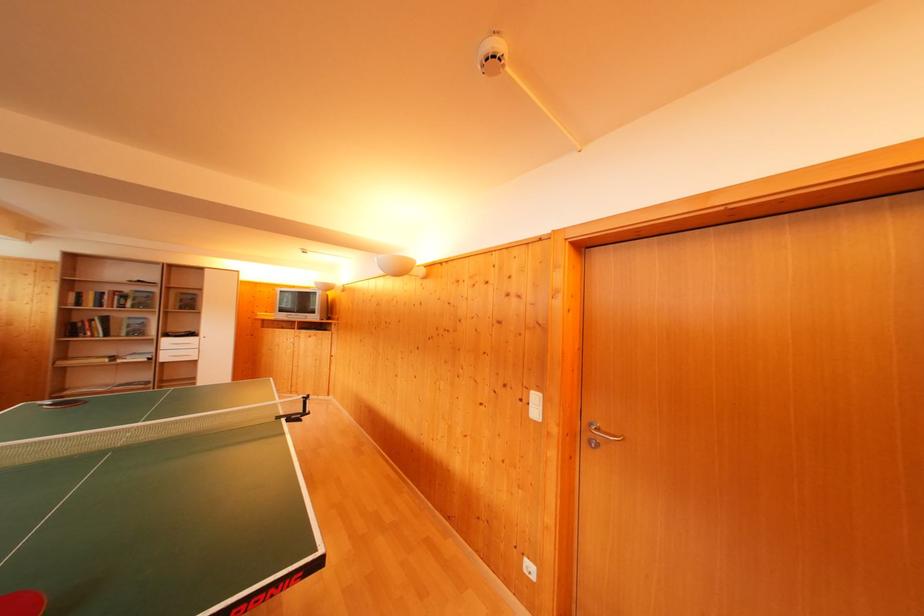
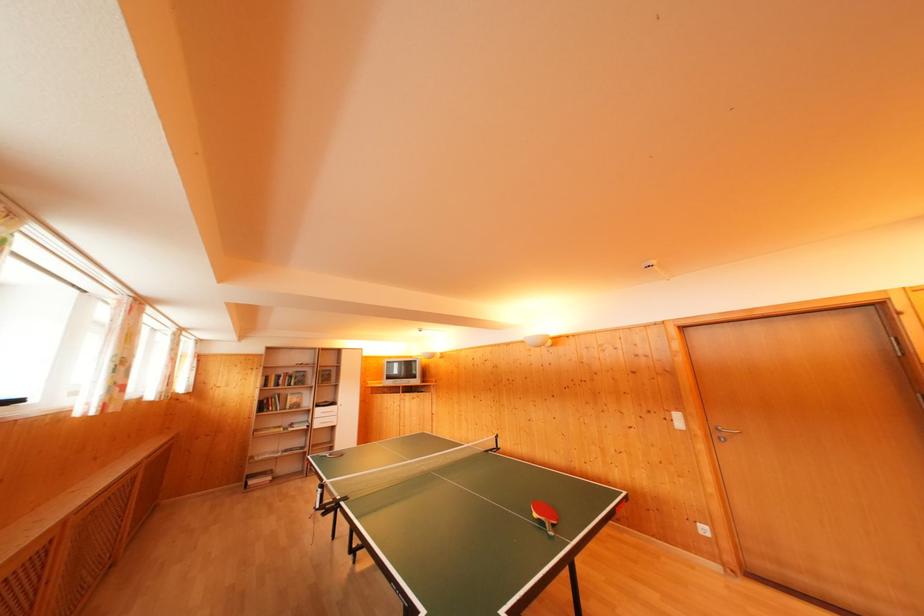
In the second image, find the point that corresponds to pixel 76 334 in the first image.

(268, 411)